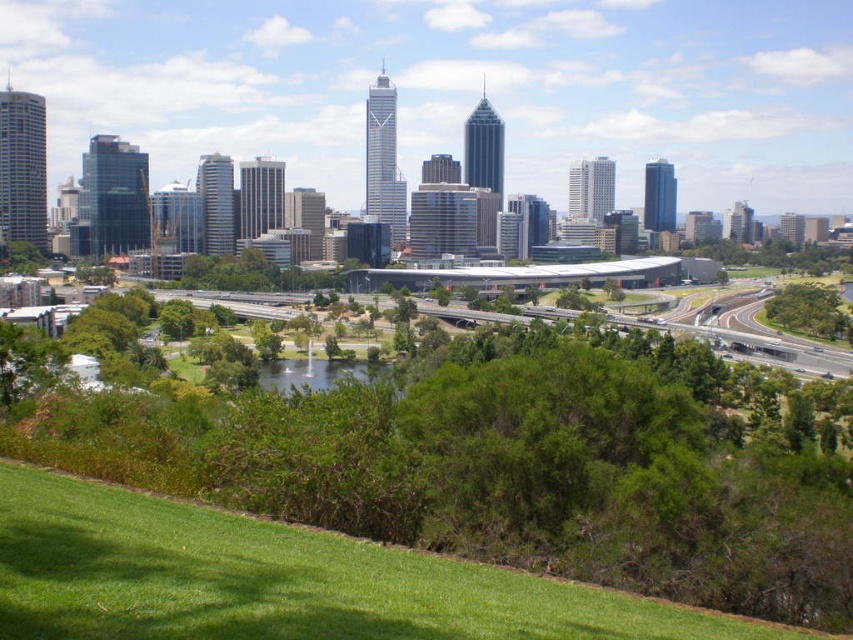
You are a drone operator who needs to fly a drone from the green grassy park at center to the green asphalt highway at center. According to the spatial relationship between these two landmarks, in which direction should you fly the drone to reach the highway?

The green grassy park at center is below the green asphalt highway at center, so you should fly the drone upwards to reach the highway.

Based on the coordinates provided, which object is located at point (519, 461) in the cityscape image?

The point (519, 461) marks the green grassy park at center.

You are a city planner analyzing this image. You need to determine which area, the green grassy park at center or the green asphalt highway at center, can accommodate more people for a community event. Which one would you choose and why?

The green grassy park at center has a larger size compared to the green asphalt highway at center, so it can accommodate more people for a community event.